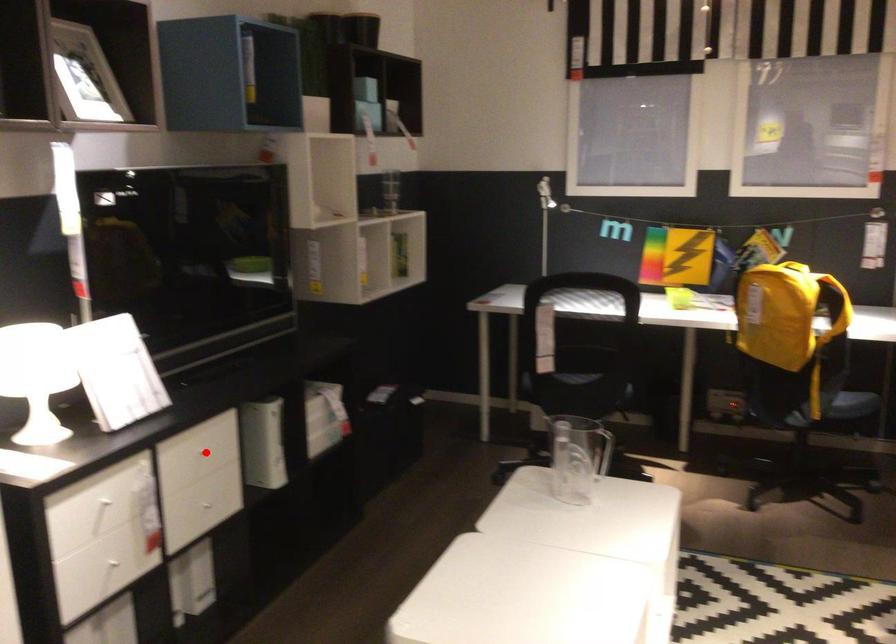
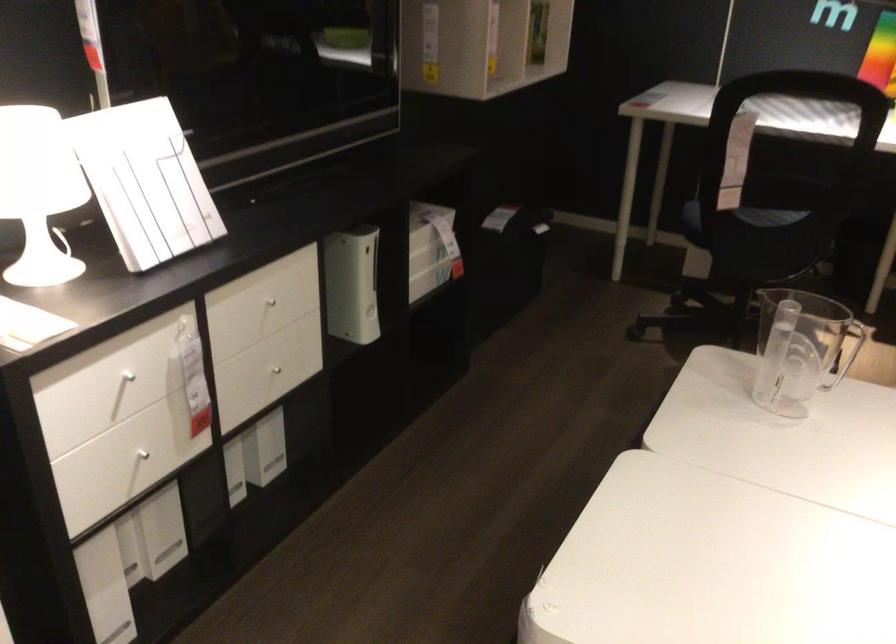
In the second image, find the point that corresponds to the highlighted location in the first image.

(271, 299)